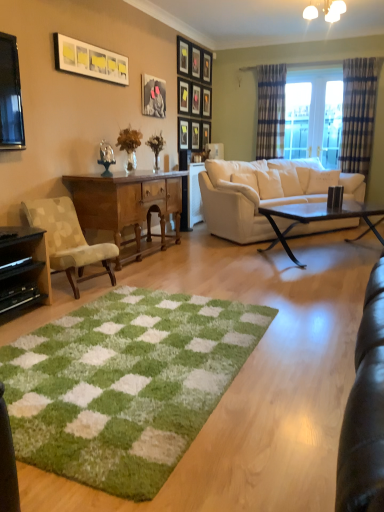
Identify the location of vacant area that is in front of black glass coffee table at center. (326, 278).